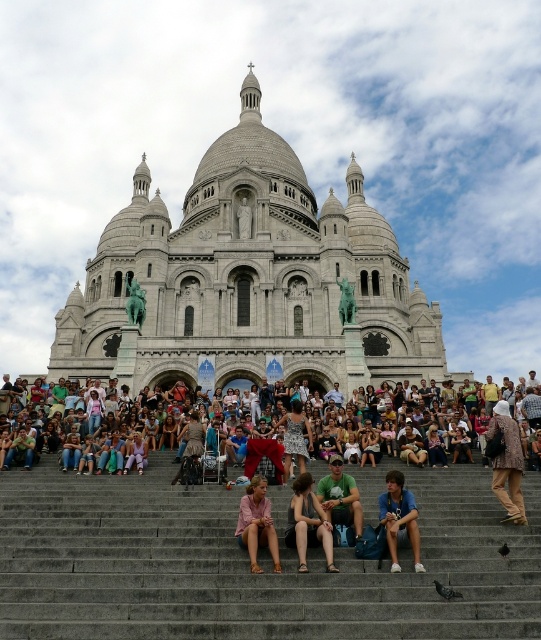
You are a photographer standing at the base of Sacre Coeur Basilica. You want to take a photo of the basilica without any people in the frame. The blue denim jeans at lower center are blocking your view. Where should you move to avoid them?

Move to the left or right of the blue denim jeans at lower center to avoid their position at point (399, 518).

You are standing at the point with coordinates (249, 280) in the image of the Sacre Coeur Basilica. What structure are you directly facing?

The point at coordinates (249, 280) corresponds to the gray stone church at center, so you are directly facing the gray stone church at center.

Consider the image. You are a photographer at the Basilica of the Sacred Heart of Paris. You see a person wearing a pink fabric dress at center and another wearing a green cotton shirt at center. Which clothing item is positioned lower in the scene?

The pink fabric dress at center is below the green cotton shirt at center, so the pink fabric dress at center is positioned lower in the scene.